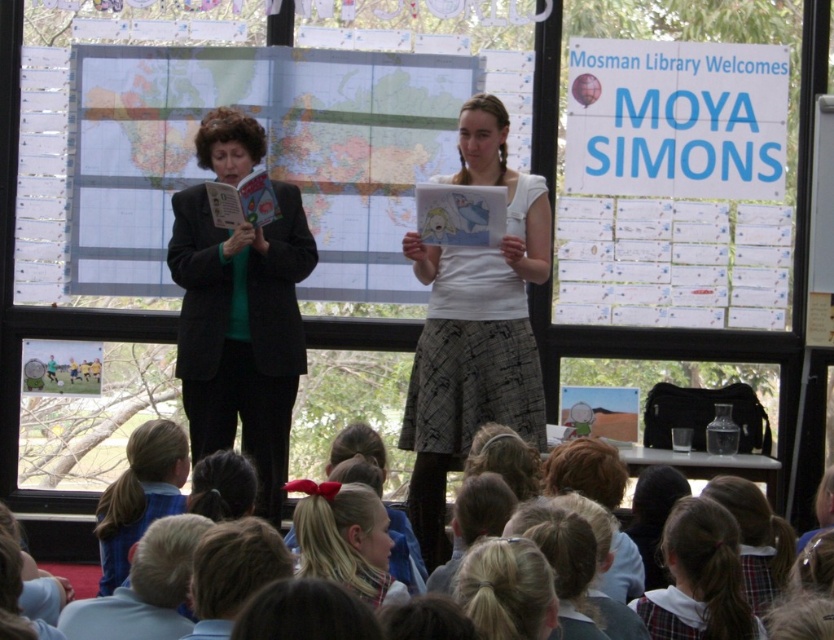
Question: Estimate the real-world distances between objects in this image. Which object is closer to the plaid hairband at center?

Choices:
 (A) black fabric jacket at left
 (B) light blue shirt at lower left
 (C) blonde hair at lower center
 (D) white cotton shirt at center

Answer: (C)

Question: Which point is farther to the camera?

Choices:
 (A) (389, 548)
 (B) (265, 429)
 (C) (164, 598)

Answer: (B)

Question: In this image, where is black fabric jacket at left located relative to plaid hairband at center?

Choices:
 (A) right
 (B) left

Answer: (B)

Question: Can you confirm if white cotton shirt at center is positioned to the right of blonde hair at lower center?

Choices:
 (A) no
 (B) yes

Answer: (B)

Question: Does plaid hairband at center appear on the right side of blue fabric at lower left?

Choices:
 (A) yes
 (B) no

Answer: (A)

Question: Which of the following is the farthest from the observer?

Choices:
 (A) (312, 486)
 (B) (224, 259)
 (C) (538, 269)
 (D) (154, 588)

Answer: (B)